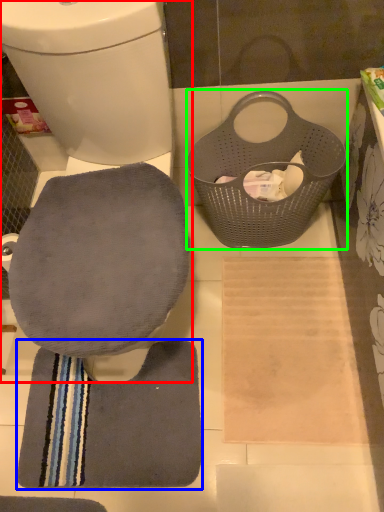
Question: Which is nearer to the toilet (highlighted by a red box)? bath towel (highlighted by a blue box) or laundry basket (highlighted by a green box).

Choices:
 (A) bath towel
 (B) laundry basket

Answer: (B)